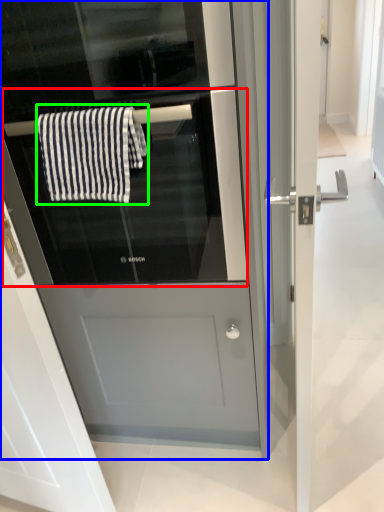
Question: Which object is positioned closest to oven (highlighted by a red box)? Select from fridge (highlighted by a blue box) and bath towel (highlighted by a green box).

Choices:
 (A) fridge
 (B) bath towel

Answer: (A)